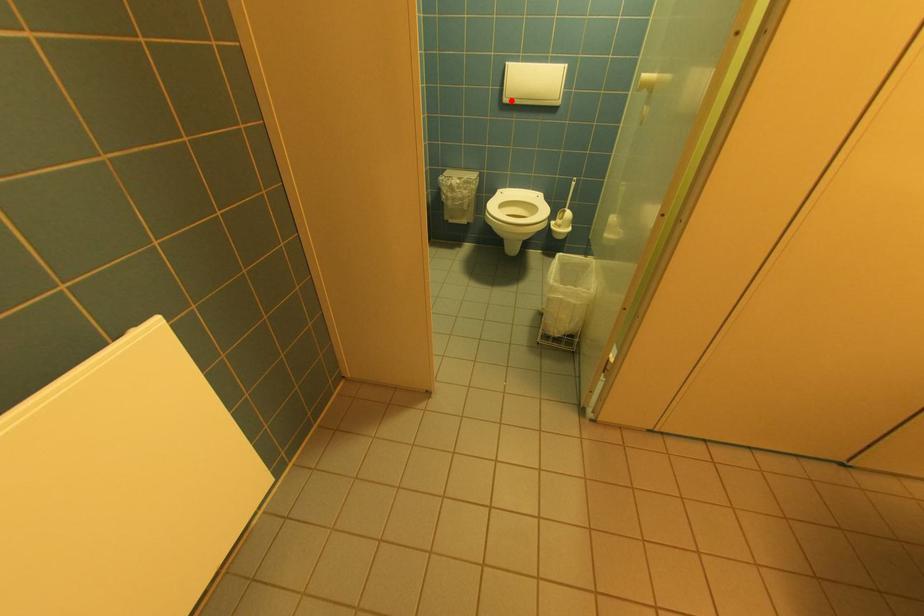
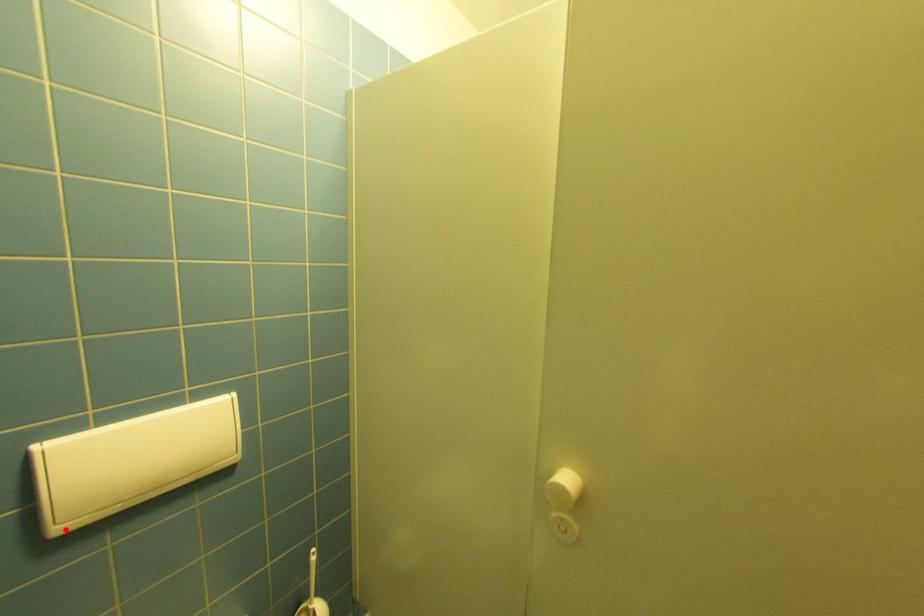
I am providing you with two images of the same scene from different viewpoints. A red point is marked on the first image and another point is marked on the second image. Does the point marked in image1 correspond to the same location as the one in image2?

Yes